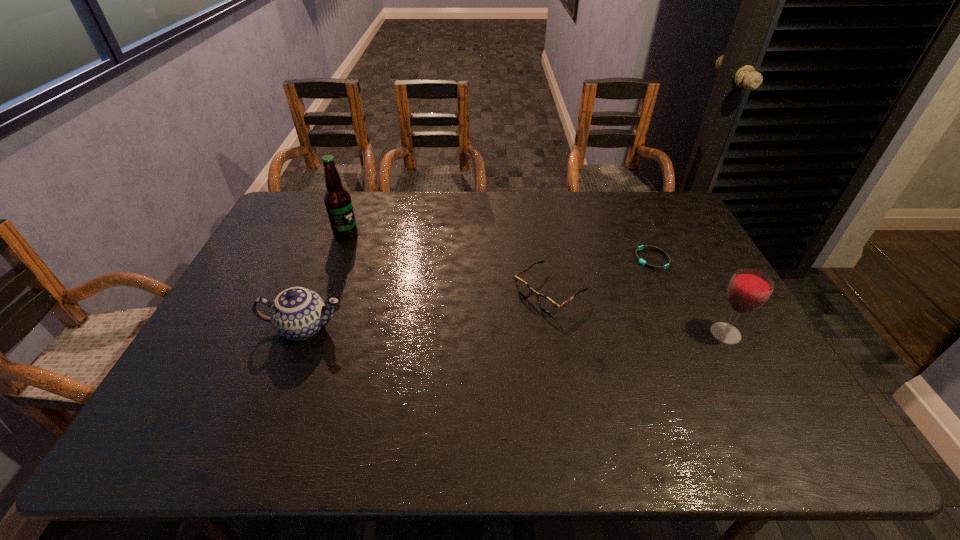
Locate an element on the screen. Image resolution: width=960 pixels, height=540 pixels. unoccupied position between the second tallest object and the beer bottle is located at coordinates coord(536,284).

Find the location of a particular element. Image resolution: width=960 pixels, height=540 pixels. vacant area that lies between the second object from right to left and the wineglass is located at coordinates (688, 296).

I want to click on vacant space that's between the farthest object and the wineglass, so click(536, 284).

Identify the location of vacant space that is in between the beer bottle and the spectacles. (447, 263).

I want to click on free point between the third object from left to right and the chinaware, so click(x=427, y=310).

The height and width of the screenshot is (540, 960). I want to click on empty space that is in between the farthest object and the rightmost object, so click(536, 284).

Identify the location of empty location between the fourth tallest object and the wristband. (601, 275).

Find the location of a particular element. The width and height of the screenshot is (960, 540). free spot between the fourth tallest object and the farthest object is located at coordinates (447, 263).

At what (x,y) coordinates should I click in order to perform the action: click on free space between the second tallest object and the spectacles. Please return your answer as a coordinate pair (x, y). This screenshot has width=960, height=540. Looking at the image, I should click on (637, 313).

Find the location of `object that is the closest to the wristband`. object that is the closest to the wristband is located at coordinates (546, 304).